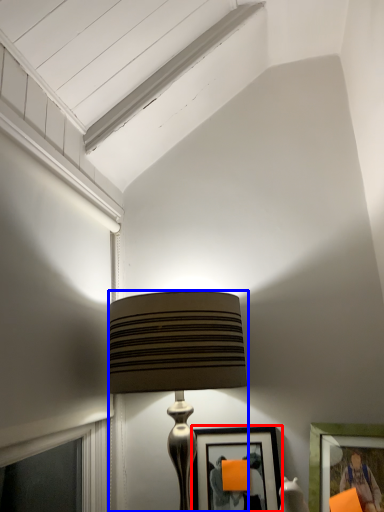
Question: Which object appears closest to the camera in this image, picture frame (highlighted by a red box) or lamp (highlighted by a blue box)?

Choices:
 (A) picture frame
 (B) lamp

Answer: (B)